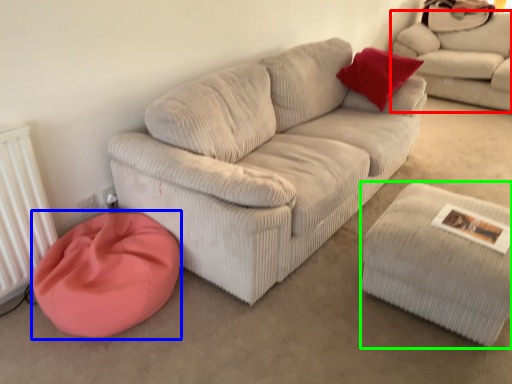
Question: Considering the real-world distances, which object is closest to studio couch (highlighted by a red box)? cat bed (highlighted by a blue box) or stool (highlighted by a green box).

Choices:
 (A) cat bed
 (B) stool

Answer: (B)